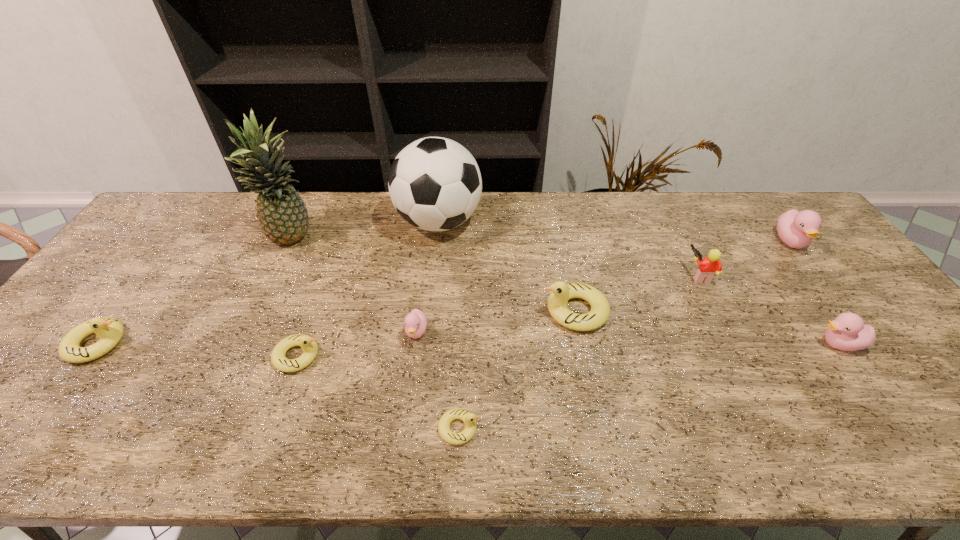
Locate an element on the screen. This screenshot has height=540, width=960. vacant space located 0.240m on the front-facing side of the second smallest pink duckling is located at coordinates (720, 344).

The width and height of the screenshot is (960, 540). What are the coordinates of `vacant area situated on the face of the leftmost yellow duckling` in the screenshot? It's located at (148, 343).

Image resolution: width=960 pixels, height=540 pixels. I want to click on vacant space situated 0.240m on the front-facing side of the third duckling from left to right, so (x=403, y=438).

The height and width of the screenshot is (540, 960). I want to click on blank space located on the face of the sixth duckling from right to left, so (350, 356).

Image resolution: width=960 pixels, height=540 pixels. In order to click on vacant space located 0.150m on the face of the second yellow duckling from right to left in this screenshot , I will do `click(549, 428)`.

Locate an element on the screen. pineapple present at the far edge is located at coordinates (283, 216).

The width and height of the screenshot is (960, 540). I want to click on soccer ball positioned at the far edge, so click(x=435, y=184).

I want to click on duckling located at the far edge, so click(x=796, y=229).

Image resolution: width=960 pixels, height=540 pixels. Identify the location of object located at the near edge. (468, 418).

The image size is (960, 540). Identify the location of object at the left edge. (110, 331).